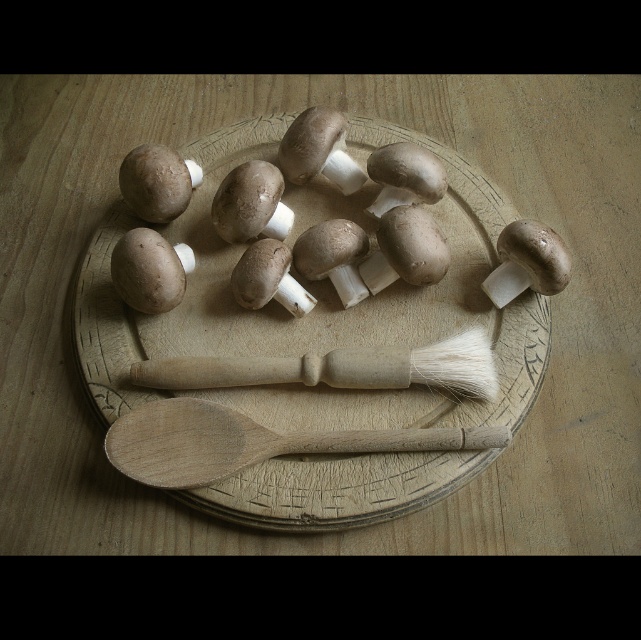
You are a chef preparing a dish and need to place the wooden spoon at lower center onto the wooden plate at center. Given that the spoon is 8 inches long, will it fit entirely on the plate?

The distance between the wooden plate at center and wooden spoon at lower center is 6.08 inches. However, the question is about the spoon fitting on the plate, not the distance between them. The provided information does not include the size of the wooden plate at center, so it cannot be determined if the 8 inch spoon will fit.

From the picture: You are a chef preparing a dish and need to reach for either the wooden spoon at lower center or the white bristle brush at center. Which one is closer to you?

The wooden spoon at lower center is closer to you than the white bristle brush at center.

You are arranging items on a rustic wooden surface. You have a wooden spoon at lower center and a white bristle brush at center. Which item is positioned lower on the surface?

The wooden spoon at lower center is positioned lower than the white bristle brush at center.